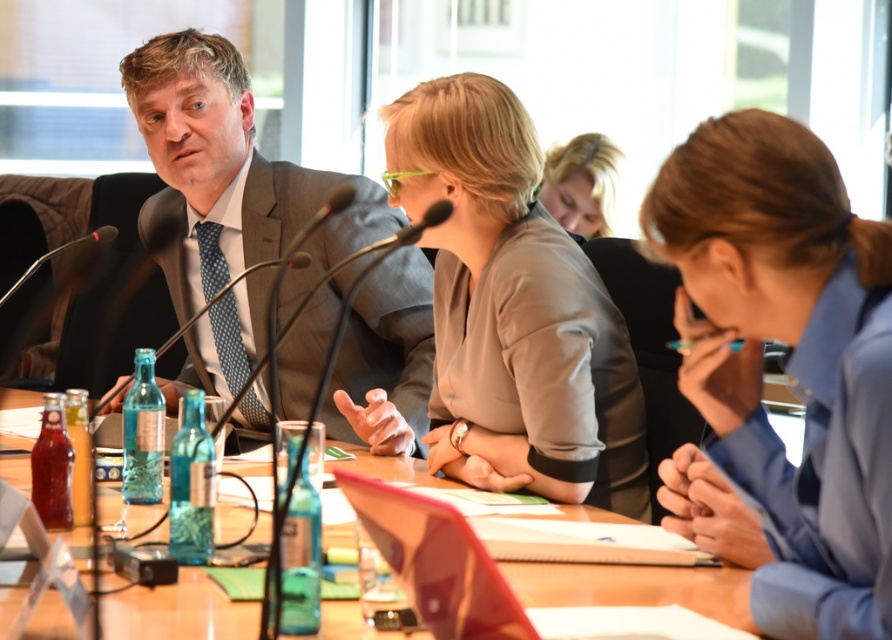
Question: Where is blue fabric shirt at center located in relation to matte gray blouse at center in the image?

Choices:
 (A) right
 (B) left

Answer: (A)

Question: Which point appears farthest from the camera in this image?

Choices:
 (A) (398, 120)
 (B) (794, 209)
 (C) (26, 403)
 (D) (343, 372)

Answer: (C)

Question: Can you confirm if blue fabric shirt at center is positioned to the left of matte gray suit at center?

Choices:
 (A) yes
 (B) no

Answer: (B)

Question: Estimate the real-world distances between objects in this image. Which object is farther from the black matte microphone at left?

Choices:
 (A) matte gray suit at center
 (B) blonde hair at upper center

Answer: (B)

Question: Which object is the closest to the matte gray blouse at center?

Choices:
 (A) translucent glass table at center
 (B) blue fabric shirt at center
 (C) black matte microphone at left
 (D) blonde hair at upper center

Answer: (A)

Question: Does matte gray suit at center have a lesser width compared to black matte microphone at left?

Choices:
 (A) yes
 (B) no

Answer: (B)